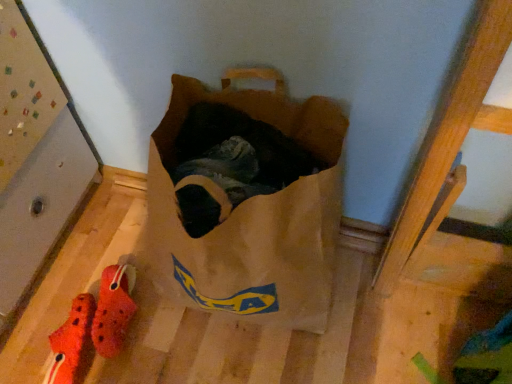
Find the location of a particular element. vacant space behind rubberized red croc at lower left, arranged as the second footwear when viewed from the left is located at coordinates (105, 256).